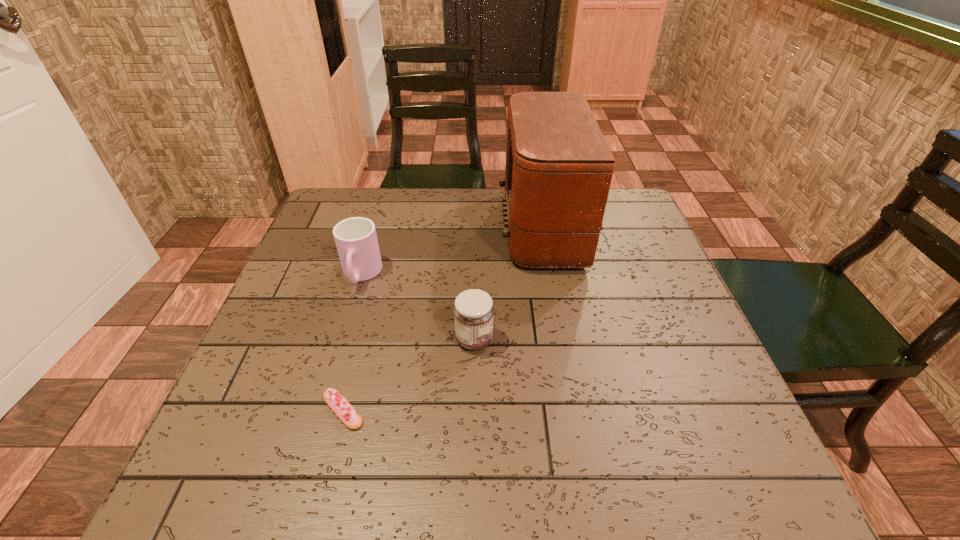
Where is `free space that satisfies the following two spatial constraints: 1. with the handle on the side of the nearest object; 2. on the right side of the cup`? The width and height of the screenshot is (960, 540). free space that satisfies the following two spatial constraints: 1. with the handle on the side of the nearest object; 2. on the right side of the cup is located at coordinates (321, 410).

The height and width of the screenshot is (540, 960). Identify the location of vacant space that satisfies the following two spatial constraints: 1. with the handle on the side of the cup; 2. on the left side of the eclair. (321, 410).